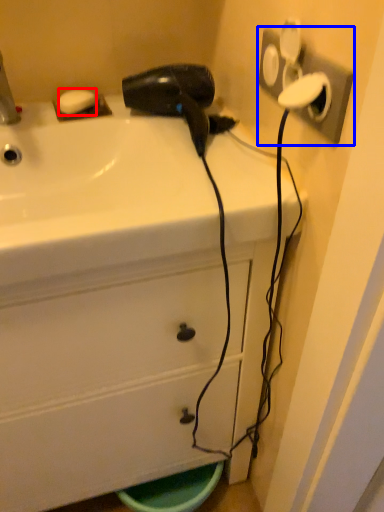
Question: Which object appears farthest to the camera in this image, soap (highlighted by a red box) or electric outlet (highlighted by a blue box)?

Choices:
 (A) soap
 (B) electric outlet

Answer: (A)